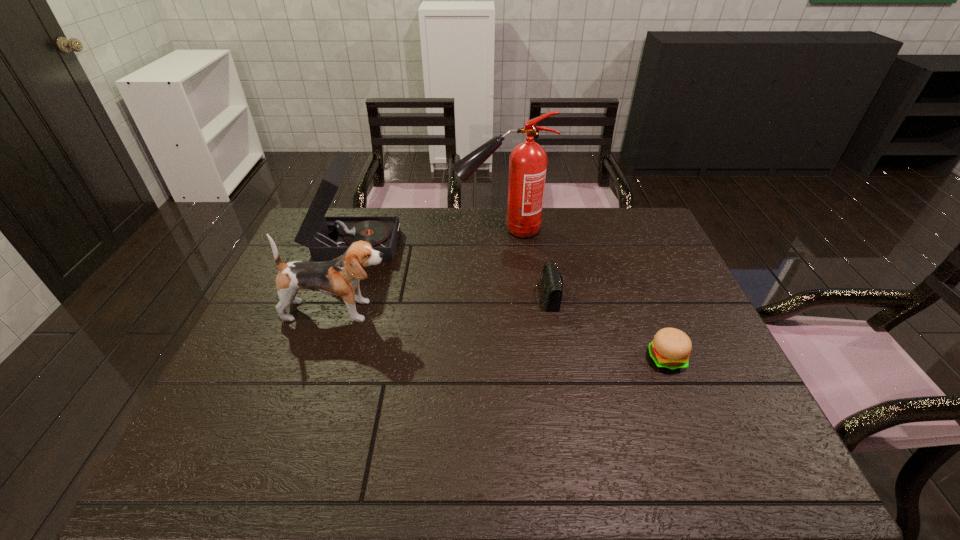
The width and height of the screenshot is (960, 540). In order to click on free spot that satisfies the following two spatial constraints: 1. at the face of the puppy; 2. on the back side of the nearest object in this screenshot , I will do `click(323, 359)`.

This screenshot has width=960, height=540. I want to click on free space that satisfies the following two spatial constraints: 1. on the front-facing side of the phonograph_record; 2. on the right side of the rightmost object, so click(x=312, y=359).

Find the location of a particular element. vacant space that satisfies the following two spatial constraints: 1. at the face of the puppy; 2. on the right side of the nearest object is located at coordinates (323, 359).

The width and height of the screenshot is (960, 540). I want to click on vacant space that satisfies the following two spatial constraints: 1. on the front flap of the hamburger; 2. on the right side of the clutch bag, so click(x=558, y=359).

I want to click on vacant position in the image that satisfies the following two spatial constraints: 1. on the front flap of the clutch bag; 2. on the back side of the nearest object, so click(x=558, y=359).

Image resolution: width=960 pixels, height=540 pixels. Find the location of `free space that satisfies the following two spatial constraints: 1. on the front-facing side of the phonograph_record; 2. on the right side of the hamburger`. free space that satisfies the following two spatial constraints: 1. on the front-facing side of the phonograph_record; 2. on the right side of the hamburger is located at coordinates (312, 359).

Where is `blank area in the image that satisfies the following two spatial constraints: 1. on the front flap of the clutch bag; 2. on the back side of the rightmost object`? The height and width of the screenshot is (540, 960). blank area in the image that satisfies the following two spatial constraints: 1. on the front flap of the clutch bag; 2. on the back side of the rightmost object is located at coordinates (558, 359).